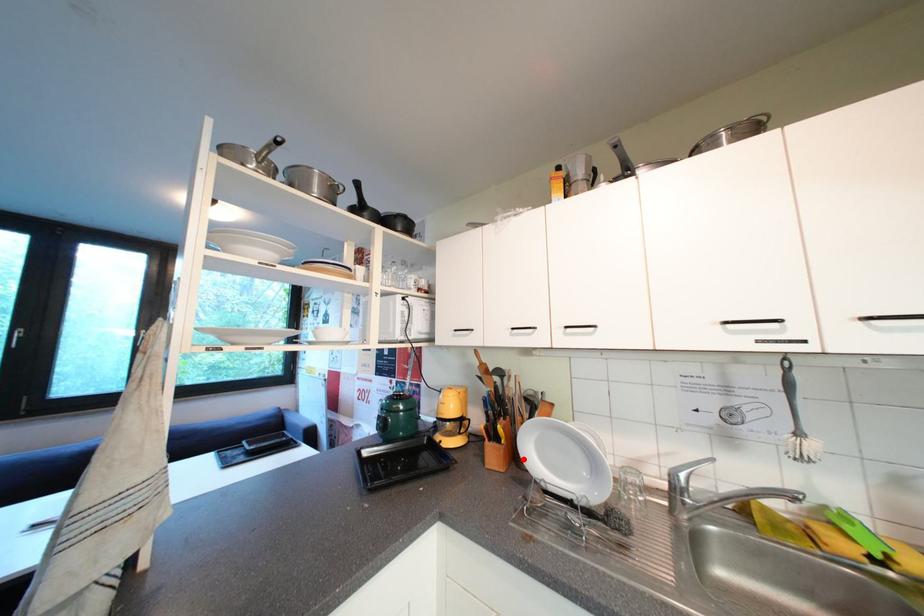
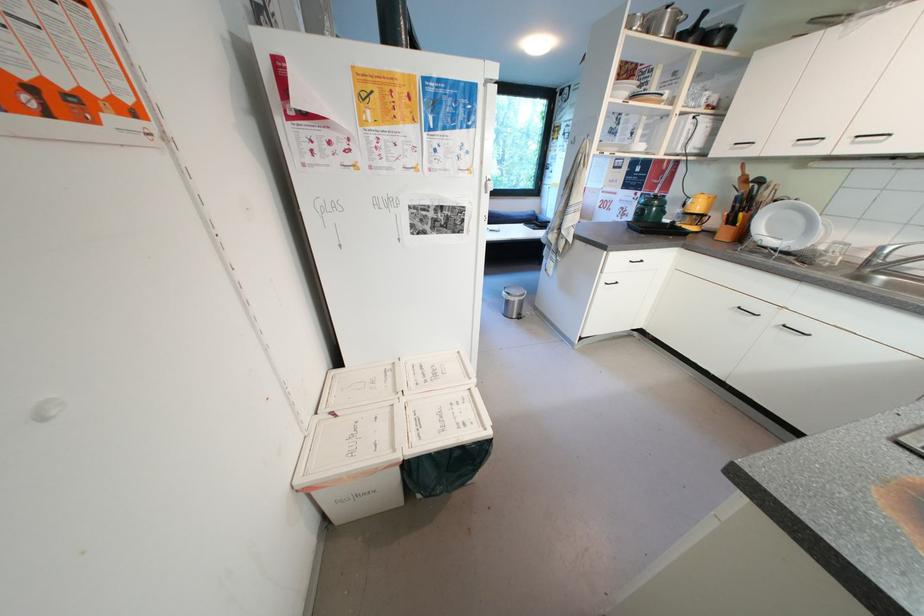
Find the pixel in the second image that matches the highlighted location in the first image.

(749, 238)